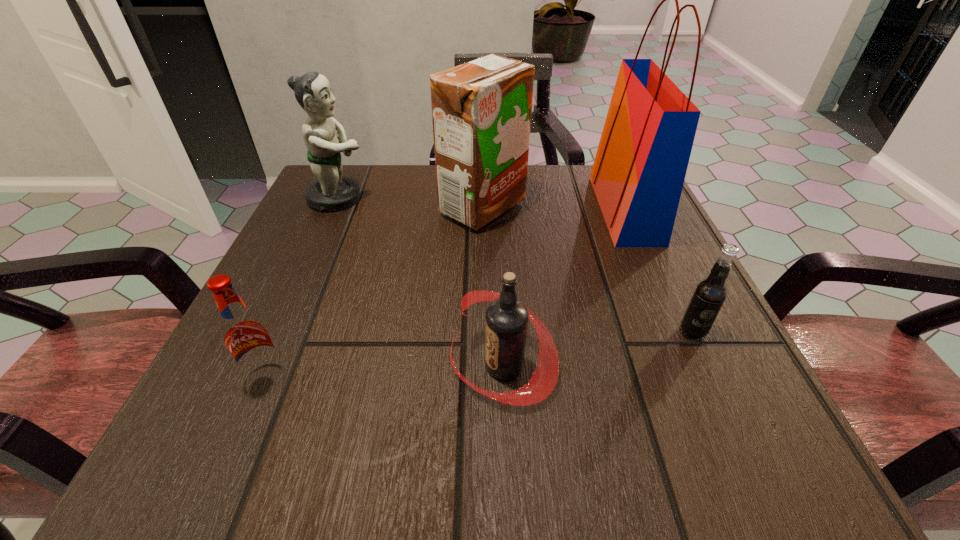
The image size is (960, 540). I want to click on vacant area that satisfies the following two spatial constraints: 1. on the label of the rightmost root beer; 2. on the label of the second root beer from left to right, so click(708, 366).